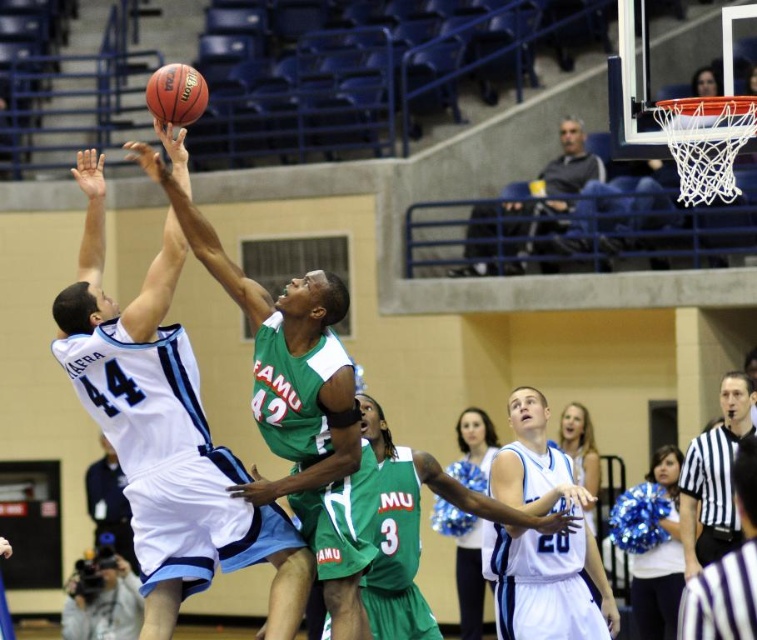
Based on the photo, you are a spectator sitting in the bleachers watching the basketball game. You notice two points marked on the court. Which point is closer to you, point 1 at coordinates (724, 436) or point 2 at coordinates (188, 124)?

Point 2 at coordinates (188, 124) is closer to you because it is less further to the viewer compared to point 1 at coordinates (724, 436).

In the scene shown: You are a photographer standing at the edge of the basketball court. You want to take a photo of both the dark gray sweater at upper center and the black and white striped shirt at lower right. Which one should you focus on first to ensure both are in sharp focus?

You should focus on the dark gray sweater at upper center first because it is closer to you than the black and white striped shirt at lower right. By focusing on the closer object, the farther one may still be in the depth of field, ensuring both are in focus.

You are a photographer positioned at the court side. You need to capture a photo of both the dark gray sweater at upper center and the black and white striped shirt at lower right in the same frame. Is there enough space between them to include both in your shot?

The dark gray sweater at upper center might be wider than black and white striped shirt at lower right, so there could be sufficient space between them to include both in your photo.